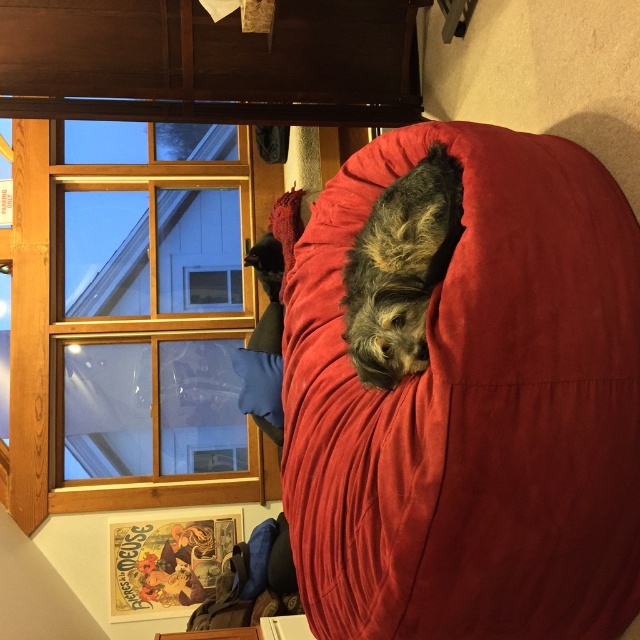
You are standing in the room and see the point at coordinates (474, 408). What object is this point located on?

The point at coordinates (474, 408) is located on the suede like red bean bag at center.